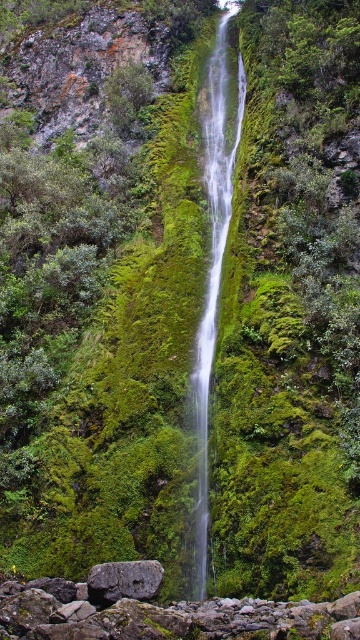
You are a hiker who wants to cross the gray rough rock at lower center to get to the other side. However, there is a clear glass waterfall at center above you. Is there a risk of getting wet from the waterfall while crossing the rock?

The clear glass waterfall at center is above the gray rough rock at lower center, so yes, there is a risk of getting wet from the waterfall while crossing the gray rough rock at lower center.

You are a hiker standing at the base of the waterfall. You see a clear glass waterfall at center. Can you safely touch the water at the point marked by point (213, 250)?

The point marked by point (213, 250) is on the clear glass waterfall at center, so touching it would mean touching the waterfall itself. Since waterfalls can have strong currents and slippery rocks, it is not safe to touch the water there.

You are standing at the base of the waterfall and want to reach both the point at coordinates point (210, 227) and point (110, 595). Which point will you encounter first as you move toward the cliff face?

You will encounter point (210, 227) first because it is closer to you than point (110, 595), which is further away.